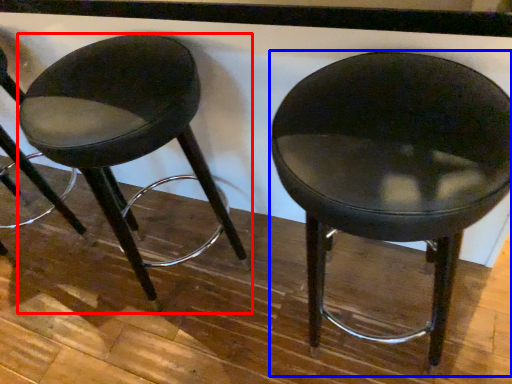
Question: Which of the following is the farthest to the observer, stool (highlighted by a red box) or chair (highlighted by a blue box)?

Choices:
 (A) stool
 (B) chair

Answer: (A)